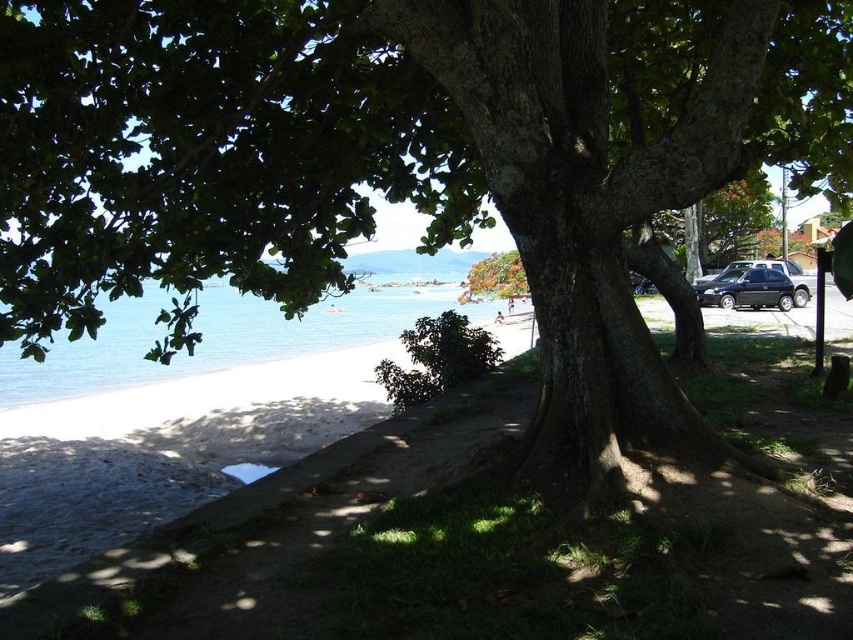
You are planning to take a photo of the clear blue water at lower left and the black matte car at right. Since you want both subjects to be visible in the frame, which one should you focus on to ensure it appears larger in the photo?

The clear blue water at lower left is already larger in size compared to the black matte car at right, so focusing on the clear blue water at lower left will ensure it appears larger in the photo.

You are driving a car and want to park it near the beach. You see the clear blue water at lower left and the black matte car at right. Which object is closer to you as you approach the scene?

The clear blue water at lower left is closer to you because it is in front of the black matte car at right.